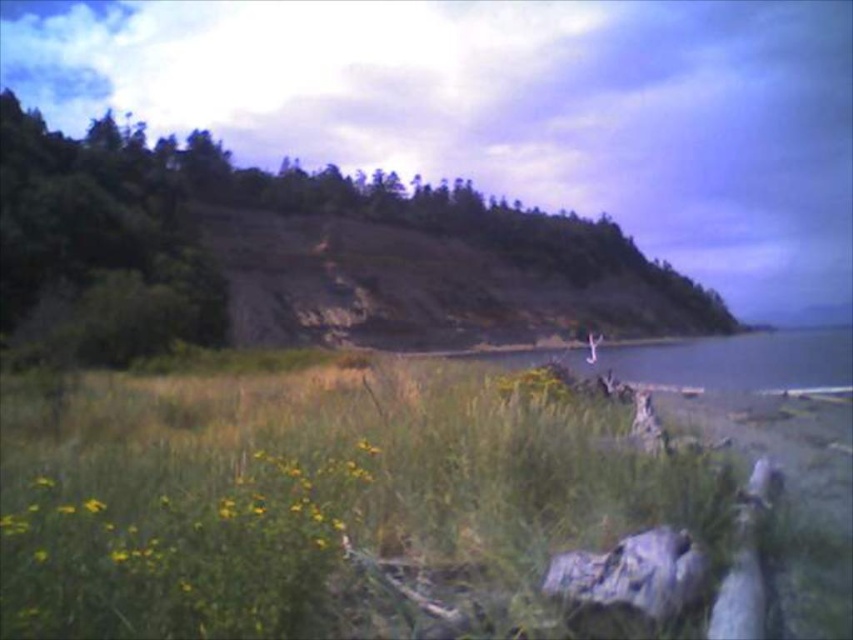
You are a hiker standing at the bottom of the hillside in the image. You want to reach the green leafy tree at upper center. Which direction should you head towards?

The green leafy tree at upper center is located at coordinates point (305, 253), so you should head towards the upper center direction to reach it.

You are planning to place a small garden statue that requires a base of at least 1 meter in diameter. Based on the image, which object between the green leafy tree at upper center and the gray rough rock at lower right would provide a suitable base for the statue?

The green leafy tree at upper center is larger in size than the gray rough rock at lower right, so it would provide a suitable base for the statue since its size meets the minimum requirement of 1 meter in diameter.